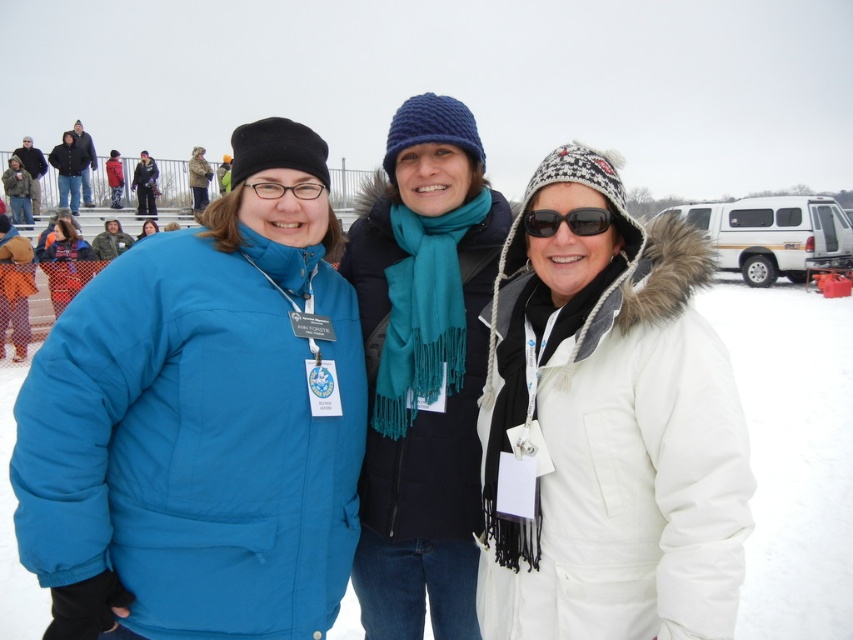
You are a photographer trying to capture the best shot of the two glasses at the center of the image. The black reflective sunglasses at center and the matte black glasses at center are both important subjects. Based on their positions, which one is closer to the camera?

The black reflective sunglasses at center is below matte black glasses at center, so the matte black glasses at center is closer to the camera because objects higher up in the image are typically closer to the viewer.

You are a photographer trying to capture a clear shot of the two people in the middle. However, you notice that one of them is wearing black reflective sunglasses at center and the other has matte black glasses at center. Which one might be harder to photograph due to glare from the snow? Explain your reasoning.

The black reflective sunglasses at center might be harder to photograph due to glare from the snow because reflective surfaces tend to bounce light more, creating glare or reflections that can obscure details. Matte black glasses at center have a non reflective surface, making them less likely to produce glare.